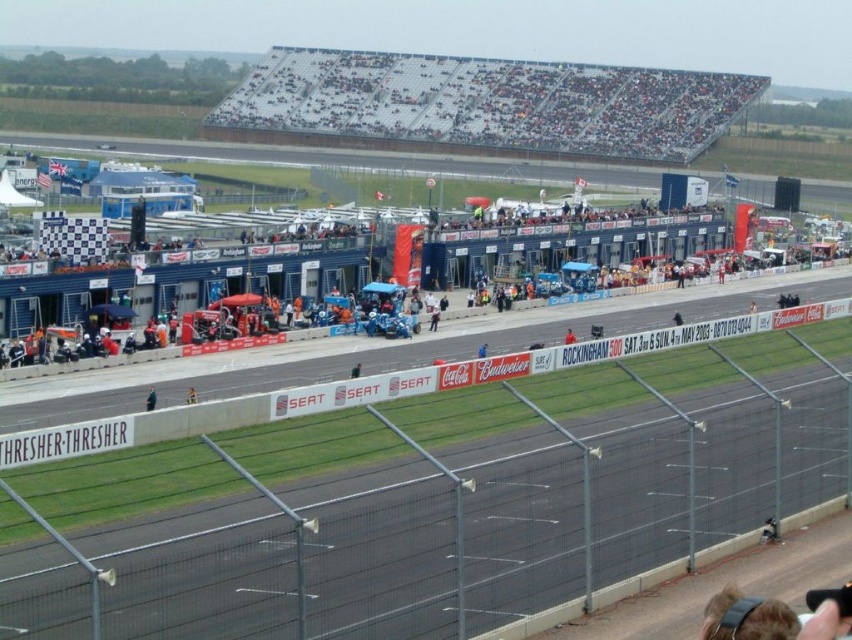
Who is taller, black fabric person at lower left or light brown wooden chair at center?

black fabric person at lower left

Locate an element on the screen. black fabric person at lower left is located at coordinates (150, 400).

Can you confirm if black asphalt race track at center is positioned above dark gray seats at upper center?

Actually, black asphalt race track at center is below dark gray seats at upper center.

Who is more forward, (348, 502) or (697, 115)?

Point (348, 502) is more forward.

Locate an element on the screen. The width and height of the screenshot is (852, 640). black asphalt race track at center is located at coordinates (468, 532).

Does dark gray seats at upper center have a greater height compared to black fabric person at lower left?

Yes, dark gray seats at upper center is taller than black fabric person at lower left.

Is point (646, 157) positioned in front of point (147, 410)?

No, (646, 157) is behind (147, 410).

Does point (692, 106) lie behind point (147, 397)?

Yes, point (692, 106) is behind point (147, 397).

I want to click on dark gray seats at upper center, so click(x=484, y=104).